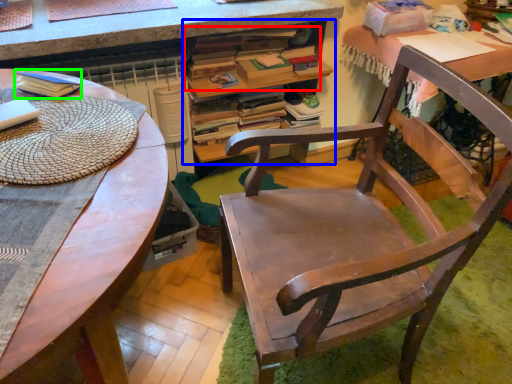
Question: Which object is the closest to the book (highlighted by a red box)? Choose among these: desk with bookshelf (highlighted by a blue box) or paperback book (highlighted by a green box).

Choices:
 (A) desk with bookshelf
 (B) paperback book

Answer: (A)